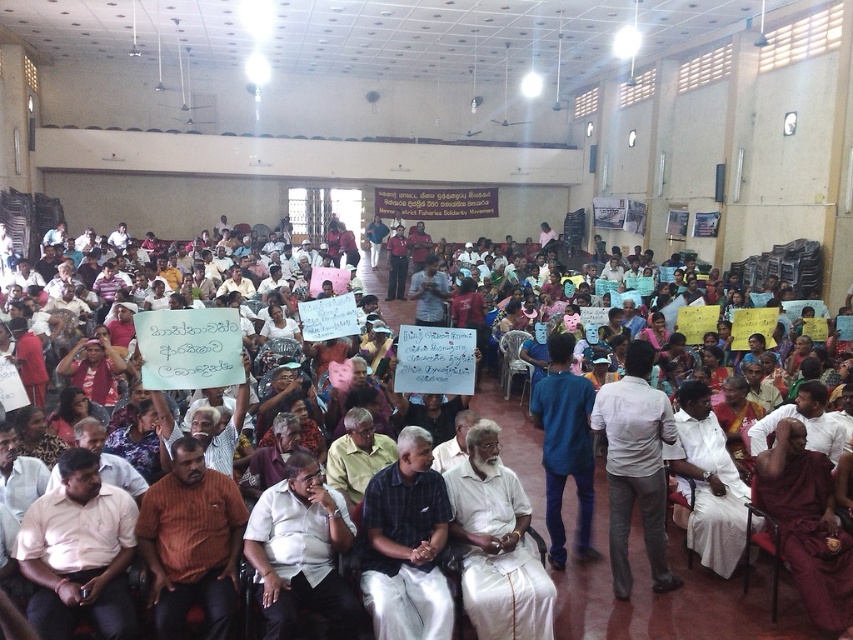
You are standing at the entrance of the hall and notice a person wearing a pink shirt at lower left. If you want to approach them, which direction should you move relative to your current position?

The pink shirt at lower left is located at point [79,552], so you should move towards the lower left direction from your current position to approach them.

You are standing at the entrance of the hall and see the pink shirt at lower left and the dark blue shirt at center. Which shirt is nearer to you?

The pink shirt at lower left is closer to the viewer than the dark blue shirt at center, so the pink shirt at lower left is nearer to you.